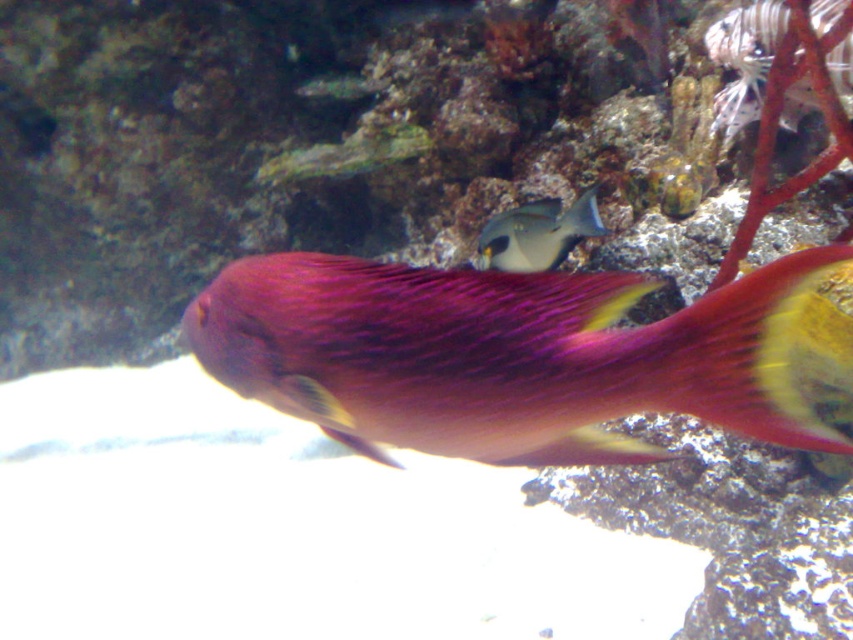
Which is behind, point (723, 35) or point (485, 243)?

The point (723, 35) is behind.

Which of these two, white spiky fish at upper right or gray matte fish at center, stands shorter?

gray matte fish at center

Between point (730, 36) and point (550, 218), which one is positioned in front?

Positioned in front is point (550, 218).

Identify the location of white spiky fish at upper right. This screenshot has height=640, width=853. (744, 60).

Can you confirm if shiny pink fish at center is positioned above white spiky fish at upper right?

No.

Is shiny pink fish at center thinner than white spiky fish at upper right?

In fact, shiny pink fish at center might be wider than white spiky fish at upper right.

Measure the distance between shiny pink fish at center and camera.

27.14 inches

Locate an element on the screen. This screenshot has height=640, width=853. shiny pink fish at center is located at coordinates (502, 355).

Does shiny pink fish at center have a smaller size compared to gray matte fish at center?

Actually, shiny pink fish at center might be larger than gray matte fish at center.

Is shiny pink fish at center positioned at the back of gray matte fish at center?

No, shiny pink fish at center is closer to the viewer.

This screenshot has height=640, width=853. What do you see at coordinates (502, 355) in the screenshot?
I see `shiny pink fish at center` at bounding box center [502, 355].

What are the coordinates of `shiny pink fish at center` in the screenshot? It's located at pyautogui.click(x=502, y=355).